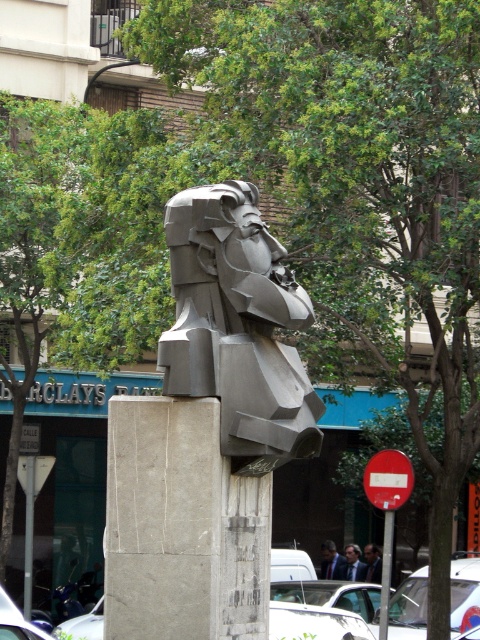
You are an art student who wants to sketch the gray stone bust at center from a distance. The recommended minimum distance to capture the entire sculpture in your drawing is 38.48 feet. Are you currently positioned at the correct distance?

Yes, you are positioned at the correct distance of 38.48 feet to capture the entire gray stone bust at center in your drawing.

You are an art student analyzing the sculpture. You notice two parts of the sculpture labeled as the gray stone bust at center and the smooth gray sculpture at center. Which one is positioned more to the left side of the sculpture?

The gray stone bust at center is positioned more to the left side of the sculpture than the smooth gray sculpture at center.